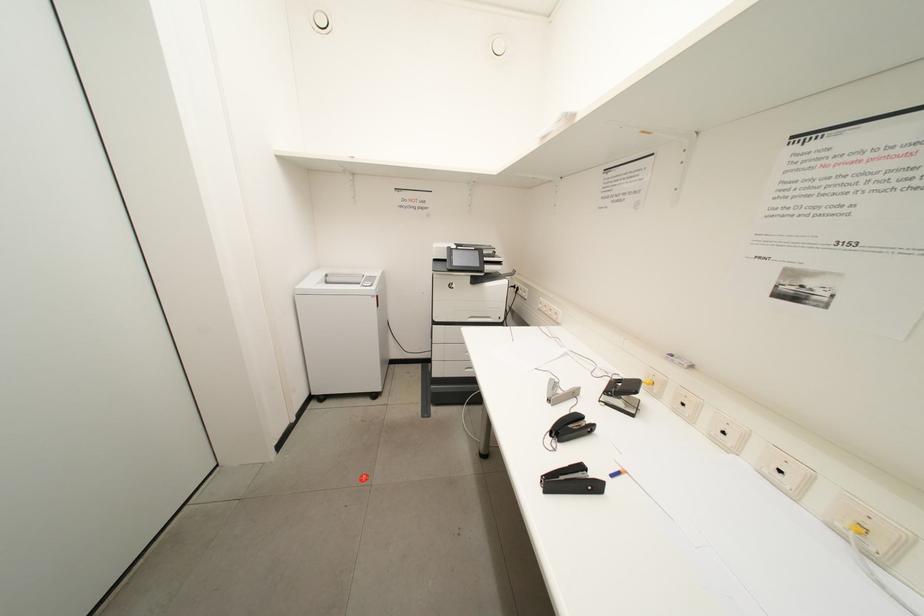
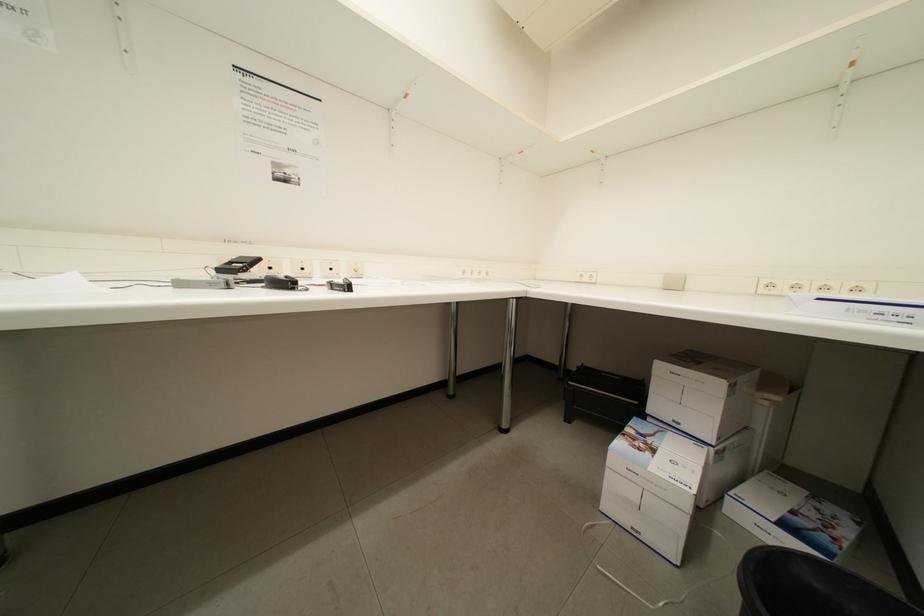
Based on the continuous images, in which direction is the camera rotating?

The rotation direction of the camera is right-down.